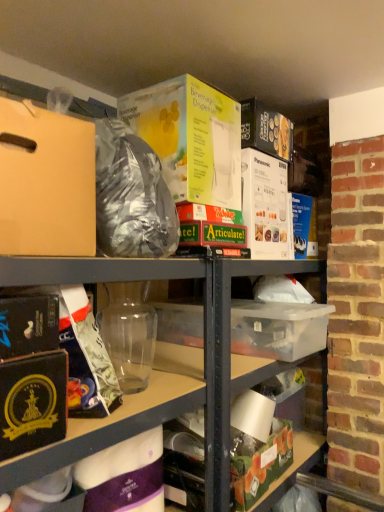
The height and width of the screenshot is (512, 384). Describe the element at coordinates (82, 353) in the screenshot. I see `matte gold wrapping paper at left, which is the second wrapping paper from bottom to top` at that location.

Find the location of a particular element. matte gold wrapping paper at left, which is the second wrapping paper from bottom to top is located at coordinates (82, 353).

Image resolution: width=384 pixels, height=512 pixels. What do you see at coordinates (190, 138) in the screenshot? I see `yellow cardboard beverage dispenser at upper center, the second paperback book in the bottom-to-top sequence` at bounding box center [190, 138].

Where is `transparent plastic container at center`? transparent plastic container at center is located at coordinates (149, 385).

From the image's perspective, is yellow cardboard beverage dispenser at upper center, which is the first paperback book from back to front, above or below green matte box at lower center?

Based on their image positions, yellow cardboard beverage dispenser at upper center, which is the first paperback book from back to front, is located above green matte box at lower center.

Could you measure the distance between yellow cardboard beverage dispenser at upper center, which appears as the first paperback book when viewed from the right, and green matte box at lower center?

yellow cardboard beverage dispenser at upper center, which appears as the first paperback book when viewed from the right, is 37.64 inches away from green matte box at lower center.

Between yellow cardboard beverage dispenser at upper center, which is counted as the 2th paperback book, starting from the left, and green matte box at lower center, which one has larger size?

Bigger between the two is yellow cardboard beverage dispenser at upper center, which is counted as the 2th paperback book, starting from the left.

Which of these two, yellow cardboard beverage dispenser at upper center, which is counted as the 2th paperback book, starting from the left, or green matte box at lower center, stands taller?

With more height is yellow cardboard beverage dispenser at upper center, which is counted as the 2th paperback book, starting from the left.

Can you confirm if purple matte wrapping paper at lower center, the 2th wrapping paper when ordered from top to bottom, is positioned to the right of green matte box at lower center?

No.

Is purple matte wrapping paper at lower center, the 2th wrapping paper when ordered from top to bottom, oriented towards green matte box at lower center?

No.

In the scene shown: Is purple matte wrapping paper at lower center, which is the 1th wrapping paper in bottom-to-top order, located outside green matte box at lower center?

Absolutely, purple matte wrapping paper at lower center, which is the 1th wrapping paper in bottom-to-top order, is external to green matte box at lower center.

Is black matte book at lower left, acting as the 2th paperback book starting from the top, outside of purple matte wrapping paper at lower center, the 2th wrapping paper when ordered from top to bottom?

Absolutely, black matte book at lower left, acting as the 2th paperback book starting from the top, is external to purple matte wrapping paper at lower center, the 2th wrapping paper when ordered from top to bottom.

From the image's perspective, which is above, black matte book at lower left, placed as the 2th paperback book when sorted from back to front, or purple matte wrapping paper at lower center, which is the 1th wrapping paper in bottom-to-top order?

black matte book at lower left, placed as the 2th paperback book when sorted from back to front, appears higher in the image.

Can you confirm if black matte book at lower left, acting as the 2th paperback book starting from the top, is wider than purple matte wrapping paper at lower center, the 2th wrapping paper when ordered from top to bottom?

Indeed, black matte book at lower left, acting as the 2th paperback book starting from the top, has a greater width compared to purple matte wrapping paper at lower center, the 2th wrapping paper when ordered from top to bottom.

Could you measure the distance between black matte book at lower left, which is counted as the second paperback book, starting from the right, and purple matte wrapping paper at lower center, the 2th wrapping paper when ordered from top to bottom?

black matte book at lower left, which is counted as the second paperback book, starting from the right, is 23.57 inches from purple matte wrapping paper at lower center, the 2th wrapping paper when ordered from top to bottom.

Between yellow cardboard beverage dispenser at upper center, the second paperback book in the bottom-to-top sequence, and black matte book at lower left, placed as the 2th paperback book when sorted from back to front, which one has larger size?

yellow cardboard beverage dispenser at upper center, the second paperback book in the bottom-to-top sequence.

From the image's perspective, is yellow cardboard beverage dispenser at upper center, the second paperback book in the bottom-to-top sequence, on top of black matte book at lower left, the first paperback book positioned from the bottom?

Yes, from the image's perspective, yellow cardboard beverage dispenser at upper center, the second paperback book in the bottom-to-top sequence, is on top of black matte book at lower left, the first paperback book positioned from the bottom.

Image resolution: width=384 pixels, height=512 pixels. Find the location of `paperback book below the yellow cardboard beverage dispenser at upper center, which appears as the first paperback book when viewed from the right (from the image's perspective)`. paperback book below the yellow cardboard beverage dispenser at upper center, which appears as the first paperback book when viewed from the right (from the image's perspective) is located at coordinates (28, 325).

From a real-world perspective, is green matte box at lower center positioned above or below purple matte wrapping paper at lower center, the 2th wrapping paper when ordered from top to bottom?

green matte box at lower center is situated lower than purple matte wrapping paper at lower center, the 2th wrapping paper when ordered from top to bottom, in the real world.

Find the location of a particular element. The width and height of the screenshot is (384, 512). box below the purple matte wrapping paper at lower center, the 2th wrapping paper when ordered from top to bottom (from the image's perspective) is located at coordinates (260, 464).

How distant is green matte box at lower center from purple matte wrapping paper at lower center, which is the 1th wrapping paper in bottom-to-top order?

green matte box at lower center and purple matte wrapping paper at lower center, which is the 1th wrapping paper in bottom-to-top order, are 14.23 inches apart from each other.

Considering the positions of objects green matte box at lower center and purple matte wrapping paper at lower center, which is the 1th wrapping paper in bottom-to-top order, in the image provided, who is more to the left, green matte box at lower center or purple matte wrapping paper at lower center, which is the 1th wrapping paper in bottom-to-top order,?

Positioned to the left is purple matte wrapping paper at lower center, which is the 1th wrapping paper in bottom-to-top order.

Is green matte box at lower center not inside matte gold wrapping paper at left, arranged as the 1th wrapping paper when viewed from the top?

That's correct, green matte box at lower center is outside of matte gold wrapping paper at left, arranged as the 1th wrapping paper when viewed from the top.

Considering the relative sizes of green matte box at lower center and matte gold wrapping paper at left, arranged as the 1th wrapping paper when viewed from the top, in the image provided, is green matte box at lower center shorter than matte gold wrapping paper at left, arranged as the 1th wrapping paper when viewed from the top,?

Indeed, green matte box at lower center has a lesser height compared to matte gold wrapping paper at left, arranged as the 1th wrapping paper when viewed from the top.

From a real-world perspective, between green matte box at lower center and matte gold wrapping paper at left, arranged as the 1th wrapping paper when viewed from the top, who is vertically lower?

green matte box at lower center is physically lower.

Considering the relative positions of green matte box at lower center and matte gold wrapping paper at left, arranged as the 1th wrapping paper when viewed from the top, in the image provided, is green matte box at lower center to the left of matte gold wrapping paper at left, arranged as the 1th wrapping paper when viewed from the top, from the viewer's perspective?

No, green matte box at lower center is not to the left of matte gold wrapping paper at left, arranged as the 1th wrapping paper when viewed from the top.

Which object is thinner, black matte book at lower left, acting as the 2th paperback book starting from the top, or yellow cardboard beverage dispenser at upper center, which is the first paperback book from back to front?

With smaller width is black matte book at lower left, acting as the 2th paperback book starting from the top.

What's the angular difference between black matte book at lower left, acting as the first paperback book starting from the left, and yellow cardboard beverage dispenser at upper center, the second paperback book in the bottom-to-top sequence,'s facing directions?

There is a 1.18-degree angle between the facing directions of black matte book at lower left, acting as the first paperback book starting from the left, and yellow cardboard beverage dispenser at upper center, the second paperback book in the bottom-to-top sequence.

Is black matte book at lower left, which is counted as the second paperback book, starting from the right, touching yellow cardboard beverage dispenser at upper center, which is the first paperback book from back to front?

No, black matte book at lower left, which is counted as the second paperback book, starting from the right, is not in contact with yellow cardboard beverage dispenser at upper center, which is the first paperback book from back to front.

You are a GUI agent. You are given a task and a screenshot of the screen. Output one action in this format:
    pyautogui.click(x=<x>, y=<y>)
    Task: Click on the box behind the yellow cardboard beverage dispenser at upper center, which is the first paperback book from back to front
    The height and width of the screenshot is (512, 384).
    Given the screenshot: What is the action you would take?
    pyautogui.click(x=260, y=464)

This screenshot has width=384, height=512. Identify the location of box on the right of the purple matte wrapping paper at lower center, which is the 1th wrapping paper in bottom-to-top order. (260, 464).

Estimate the real-world distances between objects in this image. Which object is closer to yellow cardboard beverage dispenser at upper center, which appears as the first paperback book when viewed from the right, matte cardboard box at upper left or transparent plastic container at center?

transparent plastic container at center is positioned closer to the anchor yellow cardboard beverage dispenser at upper center, which appears as the first paperback book when viewed from the right.

Which object lies further to the anchor point transparent plastic container at center, matte cardboard box at upper left or purple matte wrapping paper at lower center, which is the 1th wrapping paper in bottom-to-top order?

purple matte wrapping paper at lower center, which is the 1th wrapping paper in bottom-to-top order, is further to transparent plastic container at center.

Which object lies further to the anchor point matte cardboard box at upper left, black matte book at lower left, placed as the 2th paperback book when sorted from back to front, or transparent plastic container at center?

The object further to matte cardboard box at upper left is transparent plastic container at center.

When comparing their distances from yellow cardboard beverage dispenser at upper center, which is the first paperback book from top to bottom, does purple matte wrapping paper at lower center, which is the 1th wrapping paper in bottom-to-top order, or green matte box at lower center seem further?

green matte box at lower center is further to yellow cardboard beverage dispenser at upper center, which is the first paperback book from top to bottom.

Looking at the image, which one is located further to matte gold wrapping paper at left, arranged as the 1th wrapping paper when viewed from the top, matte cardboard box at upper left or black matte book at lower left, acting as the 2th paperback book starting from the top?

Based on the image, matte cardboard box at upper left appears to be further to matte gold wrapping paper at left, arranged as the 1th wrapping paper when viewed from the top.

When comparing their distances from black matte book at lower left, acting as the 2th paperback book starting from the top, does transparent plastic container at center or yellow cardboard beverage dispenser at upper center, which is the first paperback book from back to front, seem further?

Based on the image, yellow cardboard beverage dispenser at upper center, which is the first paperback book from back to front, appears to be further to black matte book at lower left, acting as the 2th paperback book starting from the top.

From the image, which object appears to be nearer to purple matte wrapping paper at lower center, the 2th wrapping paper when ordered from top to bottom, green matte box at lower center or matte gold wrapping paper at left, which is the second wrapping paper from bottom to top?

matte gold wrapping paper at left, which is the second wrapping paper from bottom to top.

Which object lies further to the anchor point green matte box at lower center, transparent plastic container at center or matte cardboard box at upper left?

matte cardboard box at upper left lies further to green matte box at lower center than the other object.

Identify the location of shelf situated between purple matte wrapping paper at lower center, the 2th wrapping paper when ordered from top to bottom, and green matte box at lower center from left to right. (149, 385).

The image size is (384, 512). Identify the location of wrapping paper situated between matte gold wrapping paper at left, arranged as the 1th wrapping paper when viewed from the top, and green matte box at lower center from left to right. (124, 475).

Where is `paperback book that lies between matte cardboard box at upper left and purple matte wrapping paper at lower center, the 2th wrapping paper when ordered from top to bottom, from top to bottom`? This screenshot has width=384, height=512. paperback book that lies between matte cardboard box at upper left and purple matte wrapping paper at lower center, the 2th wrapping paper when ordered from top to bottom, from top to bottom is located at coordinates (28, 325).

At what (x,y) coordinates should I click in order to perform the action: click on paperback book that lies between matte cardboard box at upper left and matte gold wrapping paper at left, arranged as the 1th wrapping paper when viewed from the top, from top to bottom. Please return your answer as a coordinate pair (x, y). Looking at the image, I should click on (28, 325).